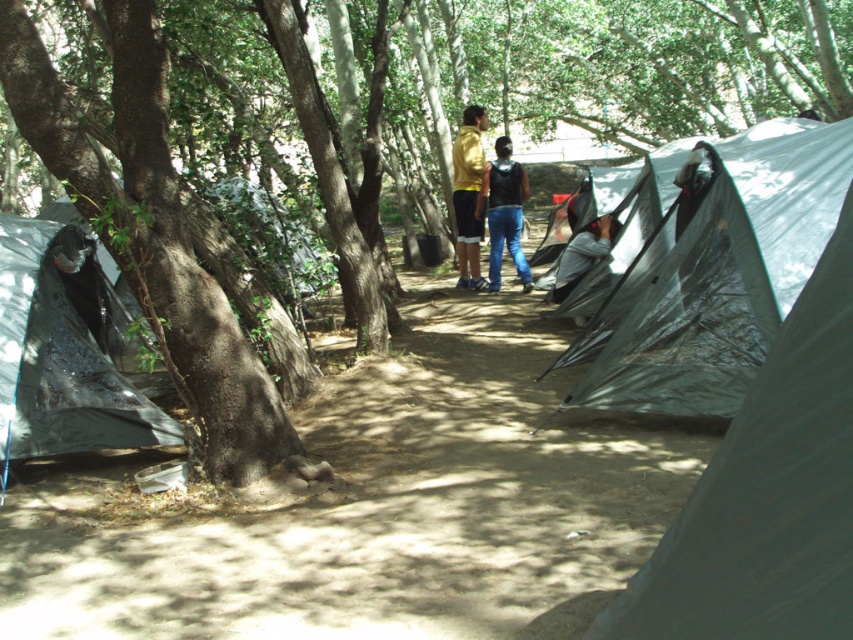
Who is shorter, black tarp at lower left or black matte vest at center?

black tarp at lower left is shorter.

Is point (15, 420) closer to viewer compared to point (520, 262)?

Yes.

The height and width of the screenshot is (640, 853). Find the location of `black tarp at lower left`. black tarp at lower left is located at coordinates (61, 353).

Can you confirm if transparent plastic tent at right is thinner than green rough bark tree at left?

No.

Can you confirm if transparent plastic tent at right is shorter than green rough bark tree at left?

Indeed, transparent plastic tent at right has a lesser height compared to green rough bark tree at left.

The image size is (853, 640). Identify the location of transparent plastic tent at right. (715, 280).

Locate an element on the screen. transparent plastic tent at right is located at coordinates (715, 280).

Is black tarp at lower left wider than yellow matte jacket at center?

Yes, black tarp at lower left is wider than yellow matte jacket at center.

You are a GUI agent. You are given a task and a screenshot of the screen. Output one action in this format:
    pyautogui.click(x=<x>, y=<y>)
    Task: Click on the black tarp at lower left
    The image size is (853, 640).
    Given the screenshot: What is the action you would take?
    pyautogui.click(x=61, y=353)

Is point (79, 429) behind point (468, 282)?

No.

I want to click on black tarp at lower left, so click(x=61, y=353).